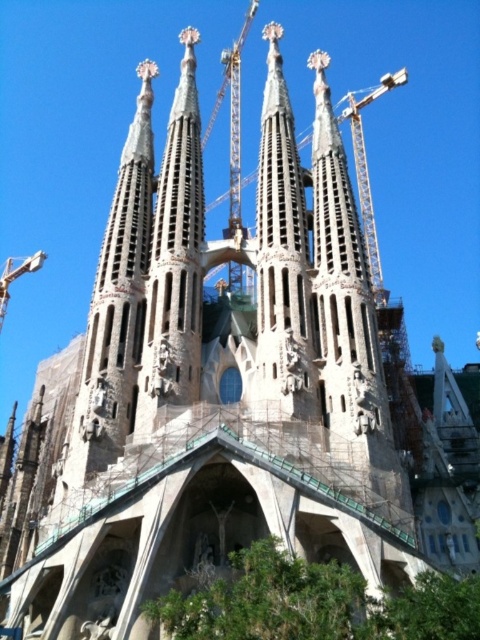
Does point (261, 134) lie in front of point (214, 200)?

That is True.

Is point (290, 385) farther from camera compared to point (216, 204)?

No, it is not.

The width and height of the screenshot is (480, 640). Identify the location of beige stone spire at center. (282, 253).